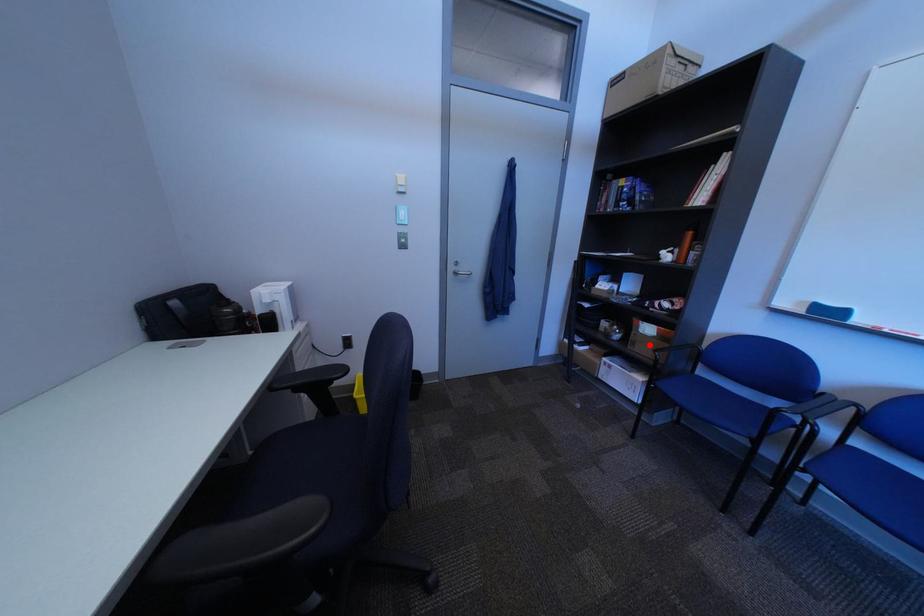
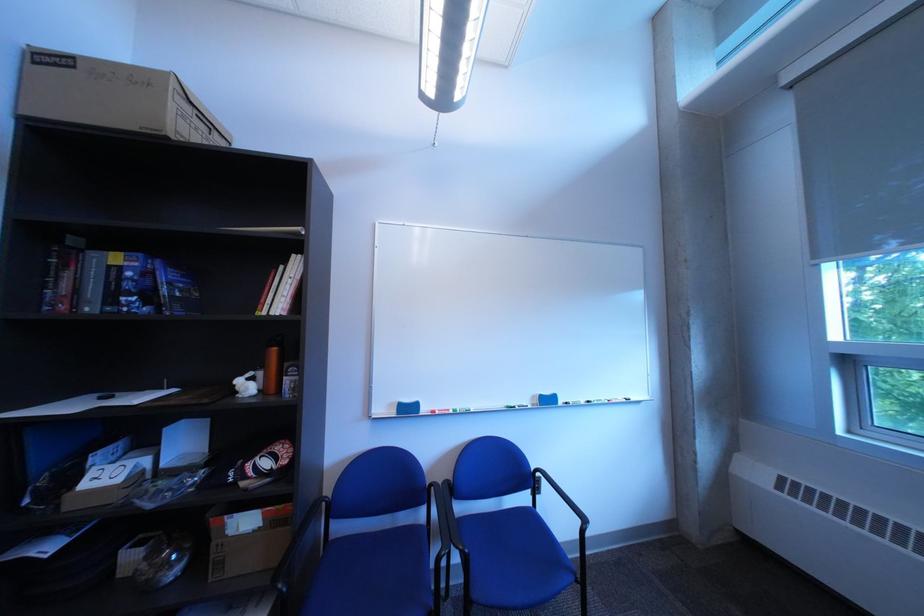
Where in the second image is the point corresponding to the highlighted location from the first image?

(237, 565)